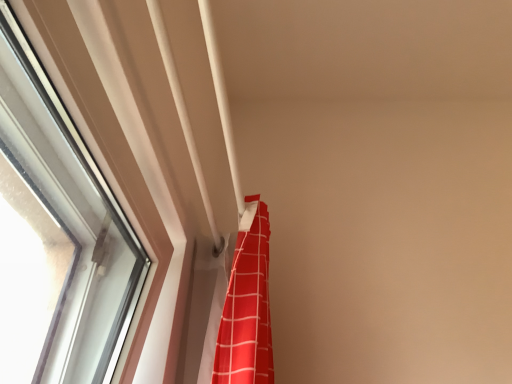
Measure the distance between point (87,207) and camera.

A distance of 1.00 meters exists between point (87,207) and camera.

Measure the distance between clear glass window at left and camera.

They are 22.63 inches apart.

Find the location of a particular element. clear glass window at left is located at coordinates (71, 215).

The height and width of the screenshot is (384, 512). Describe the element at coordinates (71, 215) in the screenshot. I see `clear glass window at left` at that location.

Locate an element on the screen. The height and width of the screenshot is (384, 512). clear glass window at left is located at coordinates (71, 215).